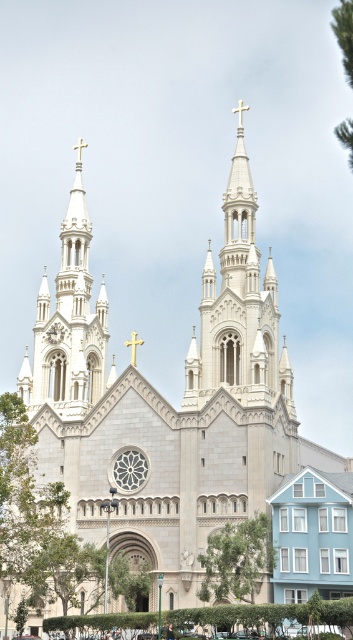
Between green leafy tree at lower left and green leafy tree at upper right, which one appears on the left side from the viewer's perspective?

green leafy tree at lower left is more to the left.

Between green leafy tree at lower left and green leafy tree at upper right, which one is positioned higher?

green leafy tree at upper right

Does point (68, 593) lie in front of point (338, 20)?

No, it is not.

Where is `green leafy tree at lower left`? This screenshot has height=640, width=353. green leafy tree at lower left is located at coordinates (48, 531).

This screenshot has width=353, height=640. Describe the element at coordinates (236, 560) in the screenshot. I see `green leafy tree at center` at that location.

Who is higher up, green leafy tree at center or green leafy tree at upper right?

green leafy tree at upper right is higher up.

At what (x,y) coordinates should I click in order to perform the action: click on green leafy tree at center. Please return your answer as a coordinate pair (x, y). Looking at the image, I should click on (236, 560).

This screenshot has width=353, height=640. I want to click on green leafy tree at center, so click(x=236, y=560).

Can you confirm if green leafy tree at lower left is taller than green leafy tree at center?

Yes.

How far apart are green leafy tree at lower left and green leafy tree at center?

green leafy tree at lower left and green leafy tree at center are 13.86 meters apart from each other.

Which is in front, point (32, 554) or point (223, 577)?

Point (223, 577) is in front.

Locate an element on the screen. green leafy tree at lower left is located at coordinates (48, 531).